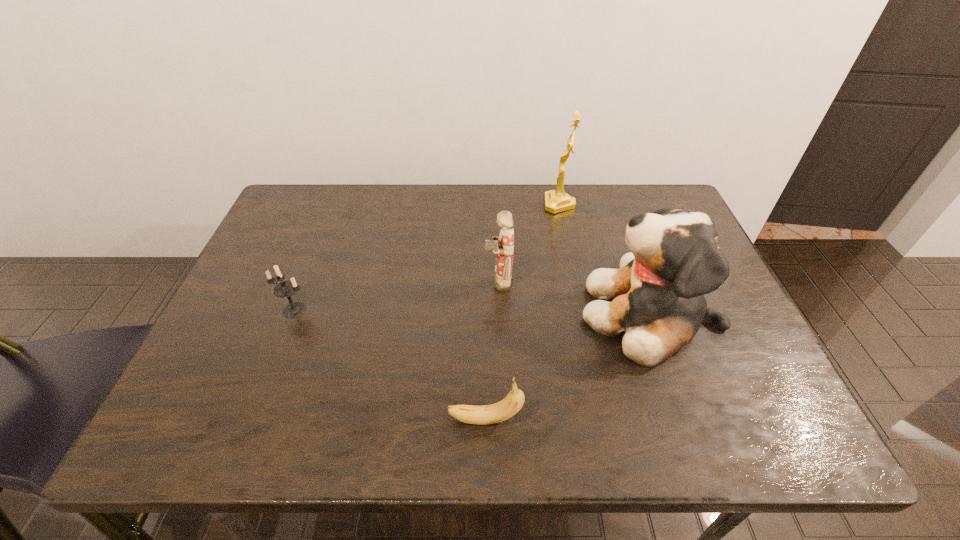
Locate an element on the screen. This screenshot has height=540, width=960. object that is at the left edge is located at coordinates (285, 289).

The width and height of the screenshot is (960, 540). Find the location of `object present at the right edge`. object present at the right edge is located at coordinates (658, 291).

The height and width of the screenshot is (540, 960). In the image, there is a desktop. Find the location of `vacant space at the far edge`. vacant space at the far edge is located at coordinates (596, 208).

I want to click on free space at the near edge of the desktop, so click(x=416, y=409).

You are a GUI agent. You are given a task and a screenshot of the screen. Output one action in this format:
    pyautogui.click(x=<x>, y=<y>)
    Task: Click on the blank space at the left edge of the desktop
    This screenshot has width=960, height=540.
    Given the screenshot: What is the action you would take?
    pyautogui.click(x=269, y=305)

The width and height of the screenshot is (960, 540). What are the coordinates of `free space at the far left corner of the desktop` in the screenshot? It's located at (287, 195).

At what (x,y) coordinates should I click in order to perform the action: click on free region at the near left corner of the desktop. Please return your answer as a coordinate pair (x, y). Image resolution: width=960 pixels, height=540 pixels. Looking at the image, I should click on (199, 425).

In the image, there is a desktop. Identify the location of free space at the far right corner. (666, 188).

Identify the location of free space between the farthest object and the third tallest object. (529, 243).

Locate an element on the screen. The height and width of the screenshot is (540, 960). empty location between the third shortest object and the award is located at coordinates (529, 243).